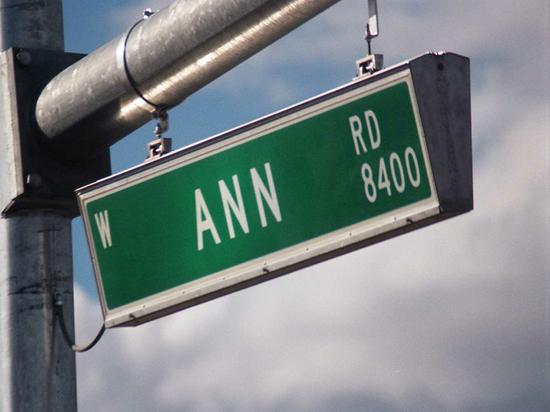
In order to click on screws in this screenshot , I will do `click(22, 63)`, `click(31, 175)`, `click(148, 13)`, `click(157, 129)`, `click(368, 34)`.